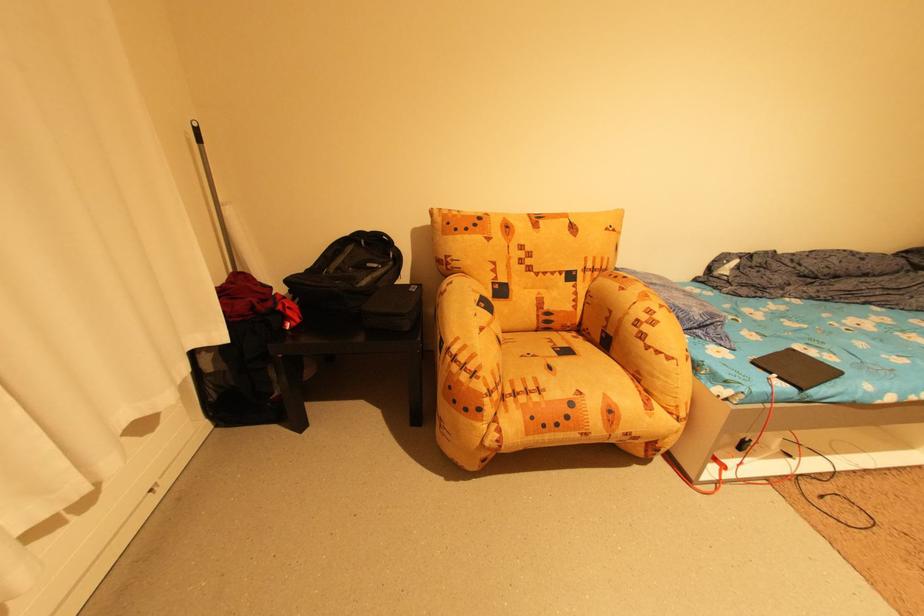
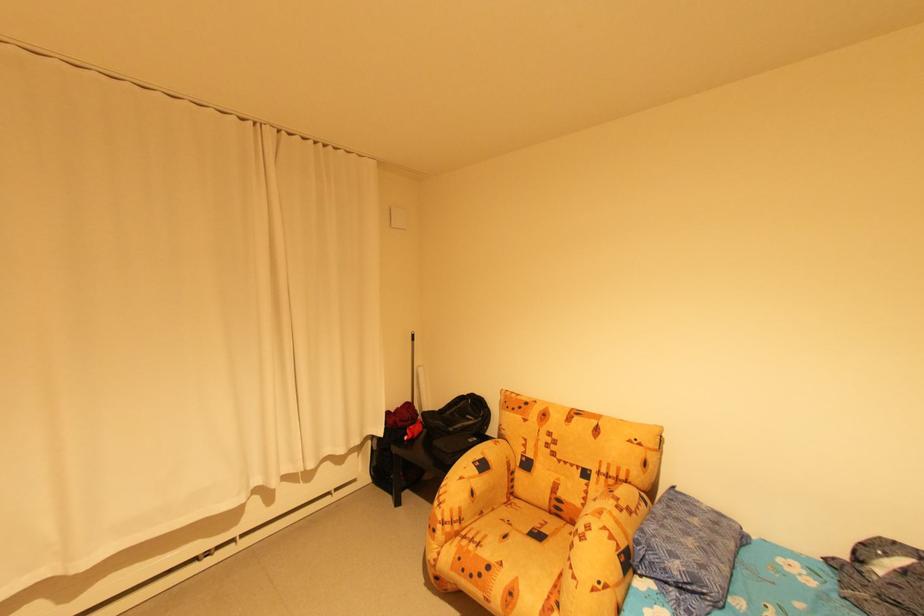
In the second image, find the point that corresponds to (546,392) in the first image.

(485, 545)